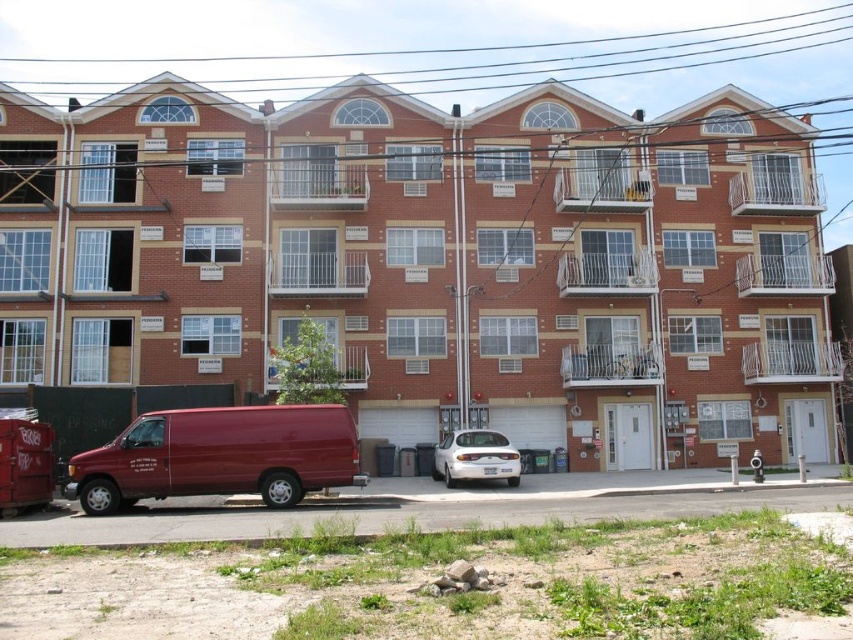
You are standing on the sidewalk in front of the residential building and notice the black wire at upper center and the matte red van at lower left. Which object is closer to you?

The black wire at upper center is closer to you because it is further to the viewer than the matte red van at lower left.

You are a delivery person trying to park your vehicle between the black wire at upper center and the matte red van at lower left. Can you fit your vehicle there?

The black wire at upper center is positioned on the right side of matte red van at lower left, so there is no space between them for your vehicle to park.

You are a delivery person trying to park a vehicle that is 2 meters wide. You see the black wire at upper center and the white glossy sedan at center in the image. Can you determine if the space between them is wide enough for your vehicle?

The black wire at upper center might be wider than the white glossy sedan at center, so the space between them may be sufficient for your 2 meter wide vehicle. However, since the exact width isn t specified, you should measure or ensure there s enough clearance before proceeding.